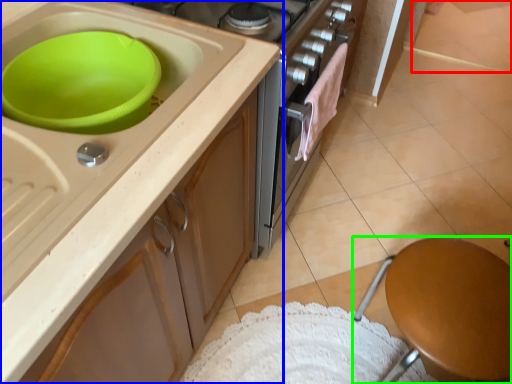
Question: Which object is positioned farthest from tile (highlighted by a red box)? Select from cabinetry (highlighted by a blue box) and furniture (highlighted by a green box).

Choices:
 (A) cabinetry
 (B) furniture

Answer: (A)